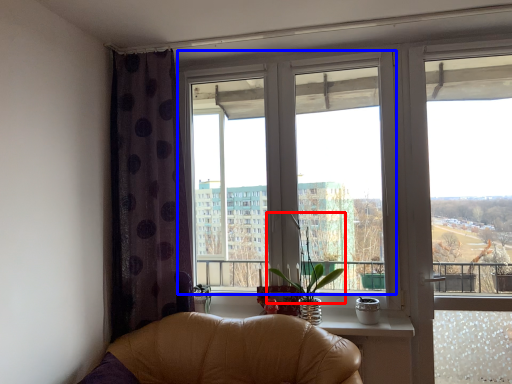
Question: Which of the following is the closest to the observer, plant (highlighted by a red box) or window (highlighted by a blue box)?

Choices:
 (A) plant
 (B) window

Answer: (A)